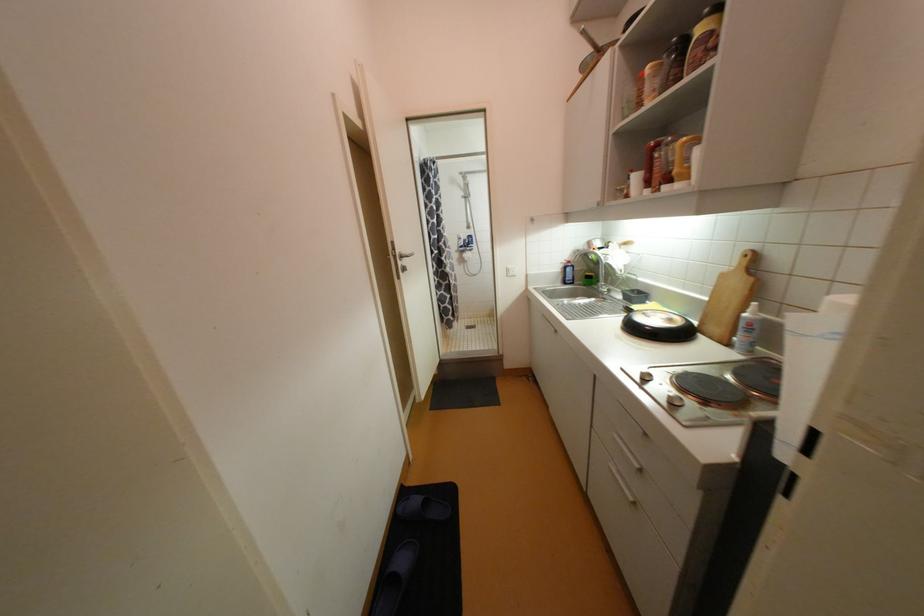
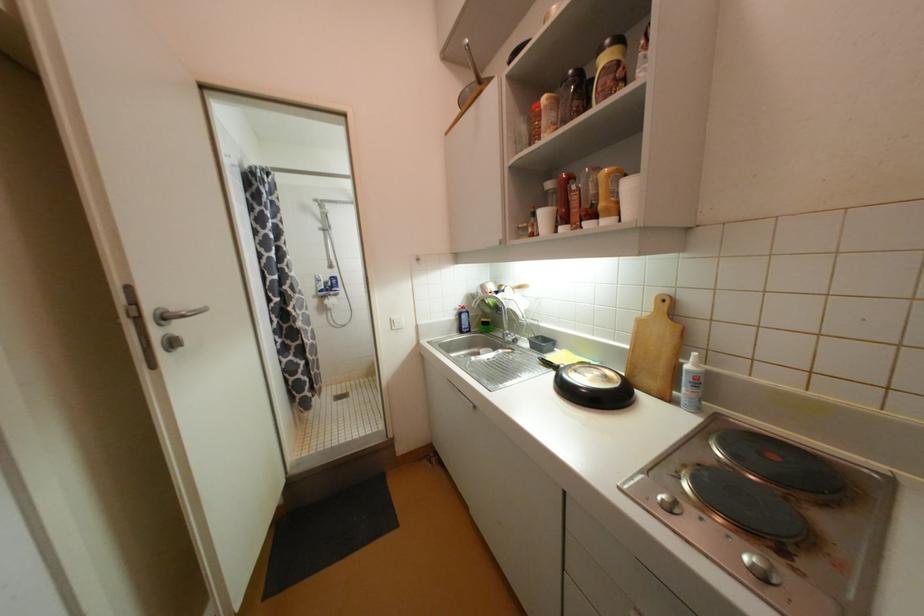
Find the pixel in the second image that matches the point at 634,312 in the first image.

(553, 365)